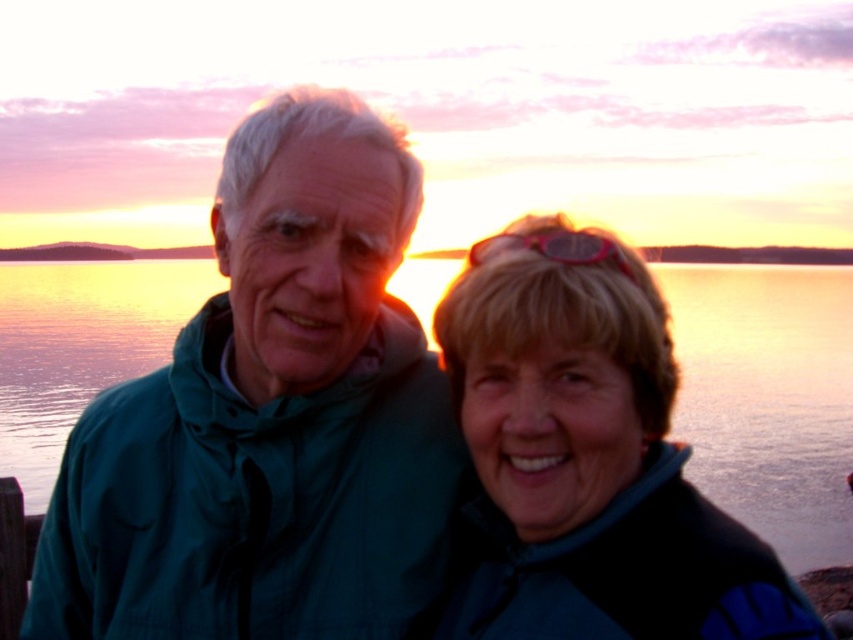
Is green fabric jacket at left wider than glossy water at center?

In fact, green fabric jacket at left might be narrower than glossy water at center.

Is point (323, 209) farther from camera compared to point (775, 410)?

No.

Where is `green fabric jacket at left`? Image resolution: width=853 pixels, height=640 pixels. green fabric jacket at left is located at coordinates (270, 417).

Which is above, glossy water at center or pink translucent goggles at upper center?

glossy water at center is higher up.

Who is positioned more to the right, glossy water at center or pink translucent goggles at upper center?

Positioned to the right is pink translucent goggles at upper center.

Does point (776, 305) come in front of point (564, 253)?

That is False.

Where is `glossy water at center`? The image size is (853, 640). glossy water at center is located at coordinates point(769,397).

Between blue fleece jacket at center and glossy water at center, which one has less height?

blue fleece jacket at center is shorter.

Can you confirm if blue fleece jacket at center is smaller than glossy water at center?

Correct, blue fleece jacket at center occupies less space than glossy water at center.

Does point (547, 525) lie in front of point (80, 380)?

That is True.

The width and height of the screenshot is (853, 640). Find the location of `blue fleece jacket at center`. blue fleece jacket at center is located at coordinates (589, 458).